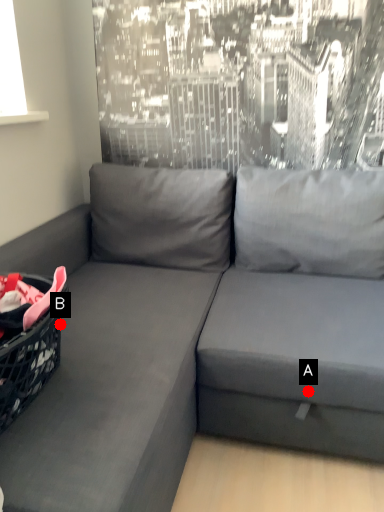
Question: Two points are circled on the image, labeled by A and B beside each circle. Which point is farther to the camera?

Choices:
 (A) A is further
 (B) B is further

Answer: (B)